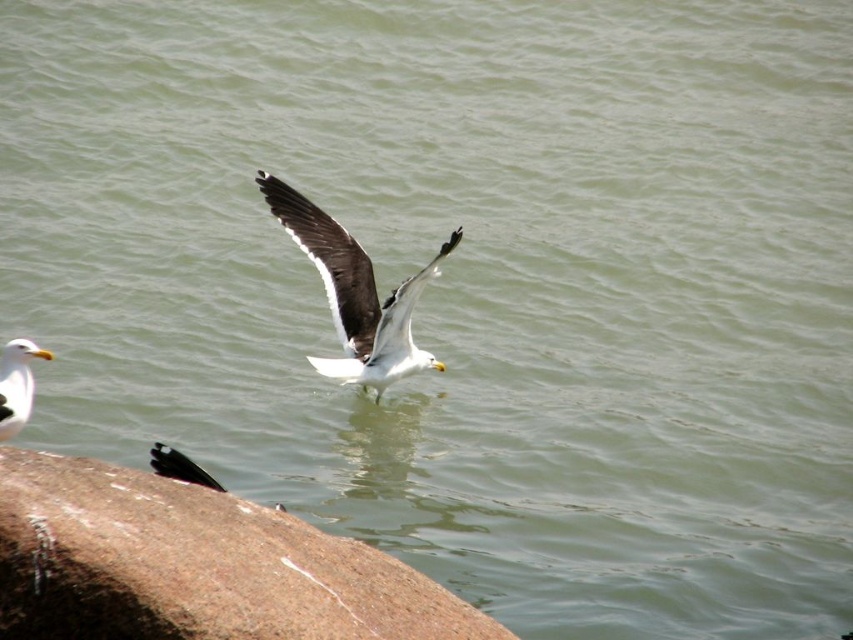
You are a photographer trying to capture both the brown granite rock at lower left and the white matte seagull at center in a single frame. Which object should you focus on first to ensure both are in the frame?

The brown granite rock at lower left occupies less space than the white matte seagull at center, so you should focus on the white matte seagull at center first to ensure both fit in the frame.

Based on the photo, you are a bird watcher standing at the edge of the water. You see the brown granite rock at lower left and the white matte seagull at lower left. If you want to observe both subjects without moving your position, which one will appear closer to you in the image?

The white matte seagull at lower left appears closer because it is only 7.09 feet away from the brown granite rock at lower left, but since both are at lower left, their relative distance from your position depends on their depth. However, based on the given information, the seagull is likely closer as it is described as the main subject in mid flight while the rock is static. But according to the objects description, the distance between them is 7.09 feet. Since the question asks which appears closer to me

You are a photographer aiming to capture both the brown granite rock at lower left and the white matte seagull at center in a single frame. Which object should you adjust your camera focus on first if you want to ensure both are in focus, considering their sizes?

The brown granite rock at lower left is wider than the white matte seagull at center. To ensure both are in focus, focus on the larger object first, which is the brown granite rock at lower left.